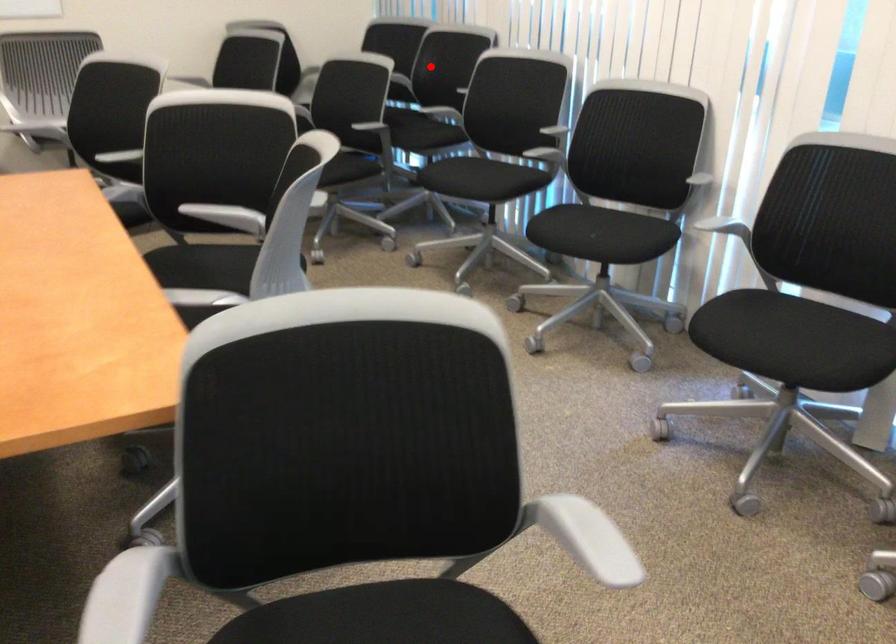
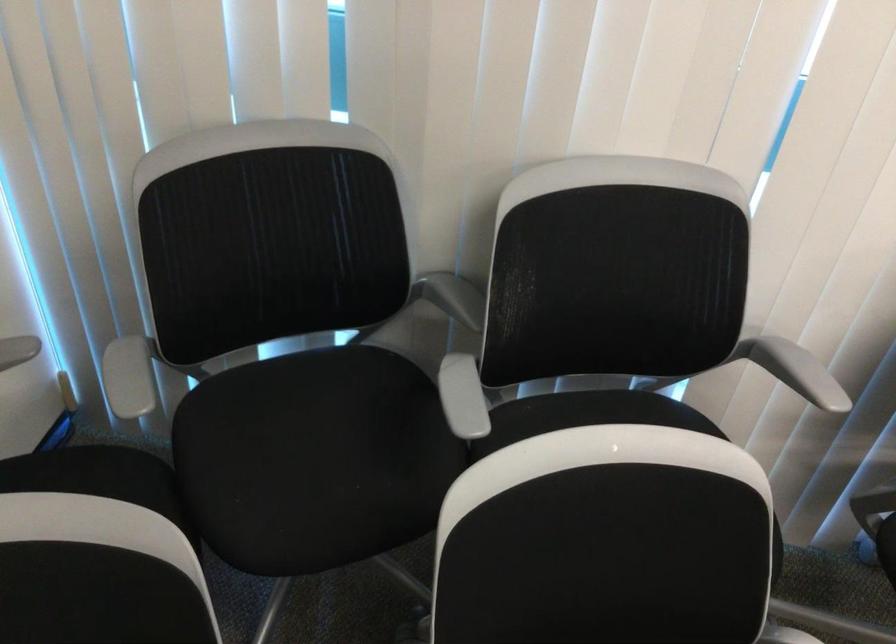
Question: I am providing you with two images of the same scene from different viewpoints. A red point is shown in image1. For the corresponding object point in image2, is it positioned nearer or farther from the camera?

Choices:
 (A) Nearer
 (B) Farther

Answer: (A)